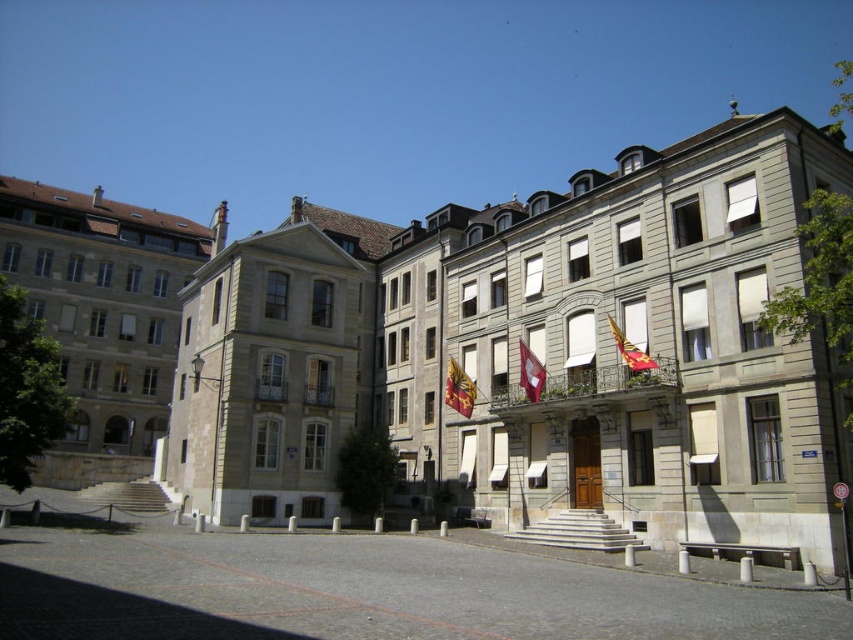
Question: Is gold textured flag at center positioned at the back of red fabric flag at upper right?

Choices:
 (A) yes
 (B) no

Answer: (A)

Question: Is red fabric flag at center wider than red fabric flag at upper right?

Choices:
 (A) no
 (B) yes

Answer: (B)

Question: Estimate the real-world distances between objects in this image. Which object is closer to the gold textured flag at center?

Choices:
 (A) red fabric flag at center
 (B) red fabric flag at upper right

Answer: (A)

Question: Based on their relative distances, which object is nearer to the red fabric flag at center?

Choices:
 (A) red fabric flag at upper right
 (B) gold textured flag at center

Answer: (B)

Question: Which object is closer to the camera taking this photo?

Choices:
 (A) red fabric flag at upper right
 (B) red fabric flag at center

Answer: (A)

Question: Does gold textured flag at center have a lesser width compared to red fabric flag at center?

Choices:
 (A) no
 (B) yes

Answer: (A)